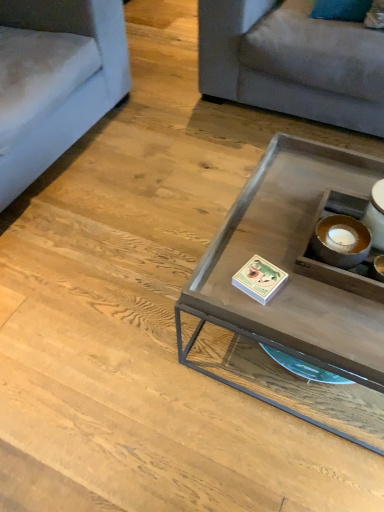
Identify the location of vacant area that lies between light gray fabric couch at upper right, which is counted as the second studio couch, starting from the left, and light blue fabric couch at left, which is the second studio couch in right-to-left order. The image size is (384, 512). (159, 130).